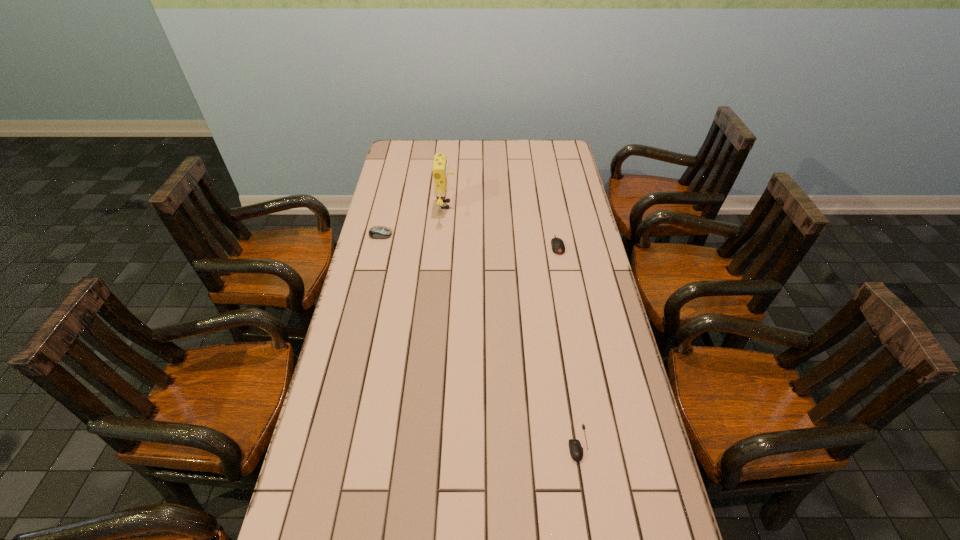
At what (x,y) coordinates should I click in order to perform the action: click on free space at the left edge of the desktop. Please return your answer as a coordinate pair (x, y). Looking at the image, I should click on pyautogui.click(x=372, y=374).

The width and height of the screenshot is (960, 540). I want to click on vacant region at the right edge of the desktop, so click(605, 312).

Where is `free spot between the nearest object and the leftmost object`? free spot between the nearest object and the leftmost object is located at coordinates (479, 339).

Find the location of a particular element. free point between the nearest object and the farthest object is located at coordinates (512, 324).

Identify the location of vacant area that lies between the leftmost mouse and the nearest mouse. (479, 339).

At what (x,y) coordinates should I click in order to perform the action: click on empty space that is in between the leftmost mouse and the shortest object. Please return your answer as a coordinate pair (x, y). This screenshot has width=960, height=540. Looking at the image, I should click on (479, 339).

Locate an element on the screen. The height and width of the screenshot is (540, 960). object identified as the third closest to the leftmost mouse is located at coordinates (576, 451).

Select which object appears as the third closest to the shortest mouse. Please provide its 2D coordinates. Your answer should be formatted as a tuple, i.e. [(x, y)], where the tuple contains the x and y coordinates of a point satisfying the conditions above.

[(377, 232)]

Locate which mouse is the closest to the shortest object. Please provide its 2D coordinates. Your answer should be formatted as a tuple, i.e. [(x, y)], where the tuple contains the x and y coordinates of a point satisfying the conditions above.

[(558, 247)]

The image size is (960, 540). Find the location of `mouse identified as the third closest to the sponge`. mouse identified as the third closest to the sponge is located at coordinates (576, 451).